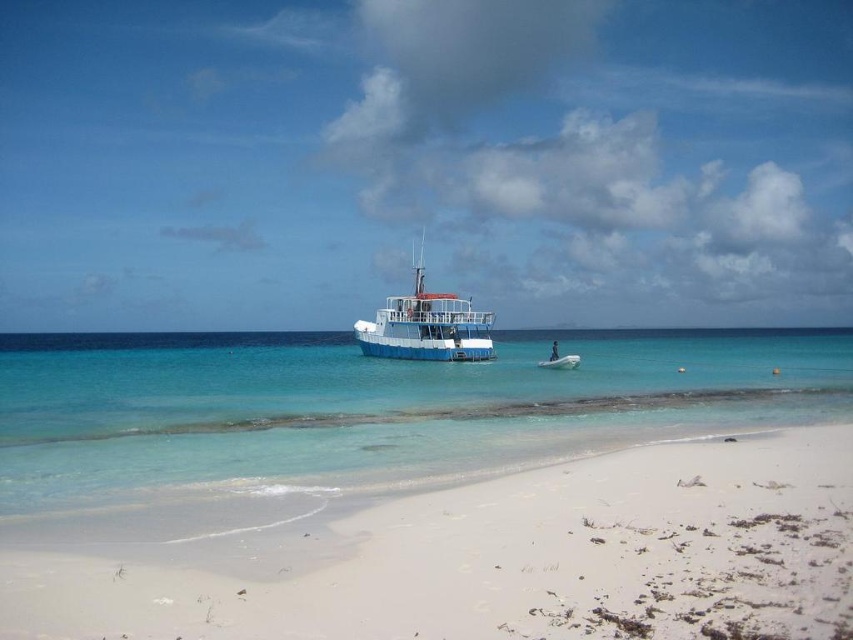
Question: Observing the image, what is the correct spatial positioning of white sandy beach at lower right in reference to blue matte boat at center?

Choices:
 (A) above
 (B) below

Answer: (B)

Question: Among these objects, which one is nearest to the camera?

Choices:
 (A) clear blue water at center
 (B) white sandy beach at lower right

Answer: (B)

Question: Among these points, which one is farthest from the camera?

Choices:
 (A) (440, 465)
 (B) (410, 545)
 (C) (405, 308)

Answer: (C)

Question: Which of these objects is positioned closest to the clear blue water at center?

Choices:
 (A) blue matte boat at center
 (B) white sandy beach at lower right

Answer: (A)

Question: Considering the relative positions of clear blue water at center and blue matte boat at center in the image provided, where is clear blue water at center located with respect to blue matte boat at center?

Choices:
 (A) right
 (B) left

Answer: (A)

Question: Can you confirm if white sandy beach at lower right is positioned to the left of blue matte boat at center?

Choices:
 (A) no
 (B) yes

Answer: (A)